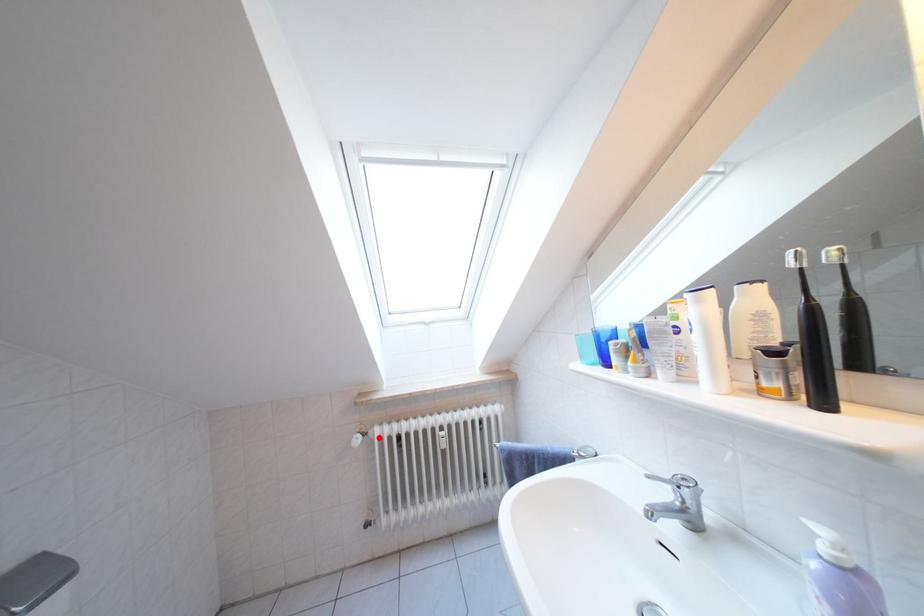
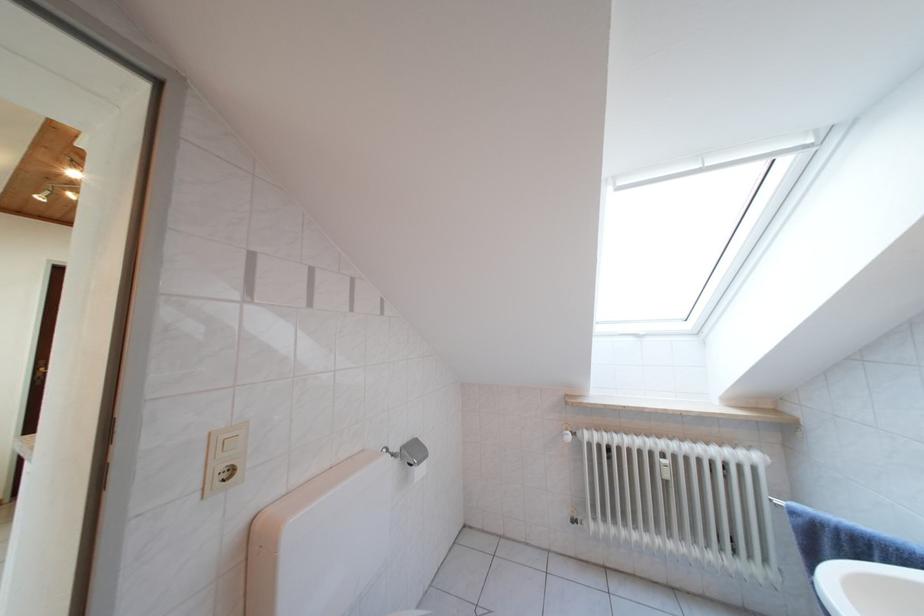
Question: I am providing you with two images of the same scene from different viewpoints. A red point is marked on the first image. Is the red point's position out of view in image 2?

Choices:
 (A) Yes
 (B) No

Answer: (B)